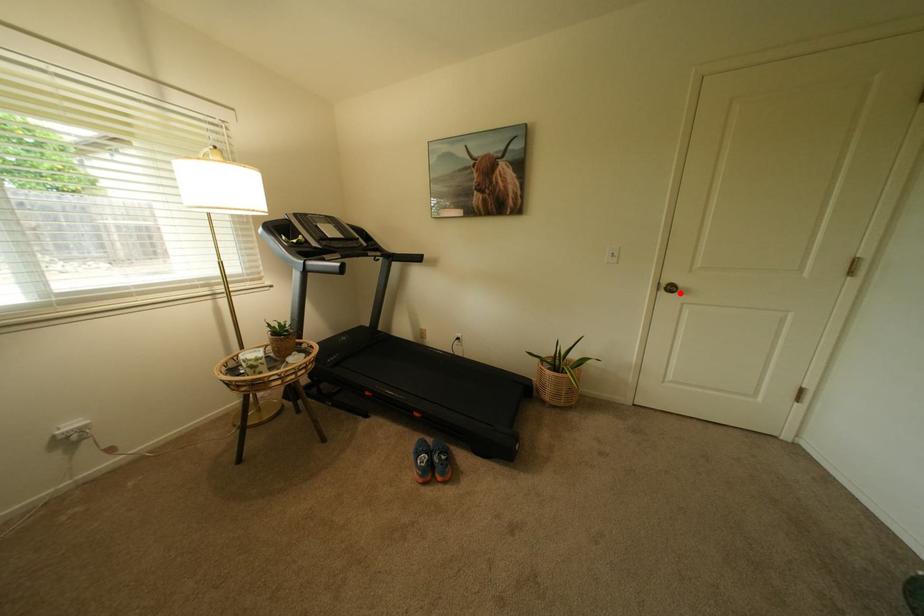
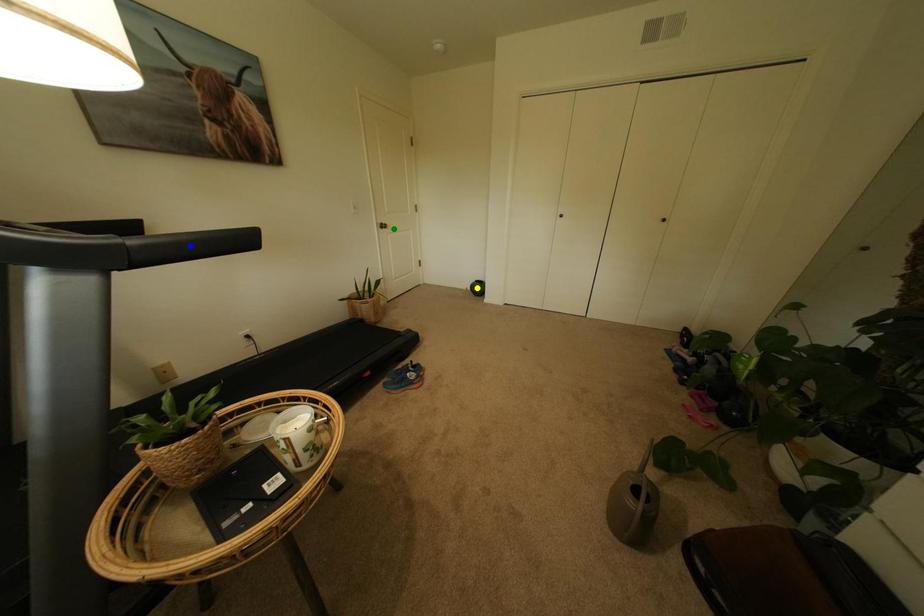
Question: I am providing you with two images of the same scene from different viewpoints. A red point is marked on the first image. You are given multiple points on the second image. Which point in image 2 represents the same 3d spot as the red point in image 1?

Choices:
 (A) green point
 (B) yellow point
 (C) blue point

Answer: (A)